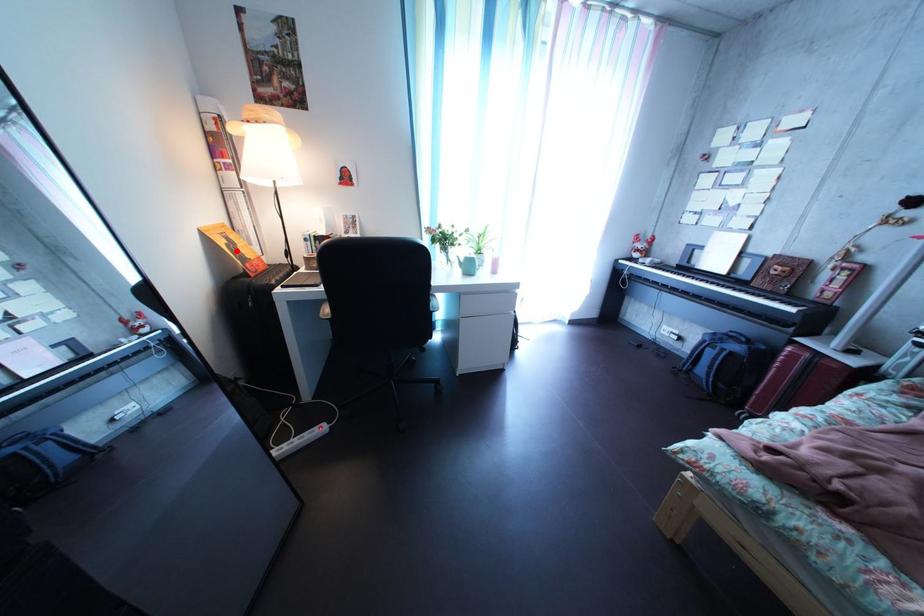
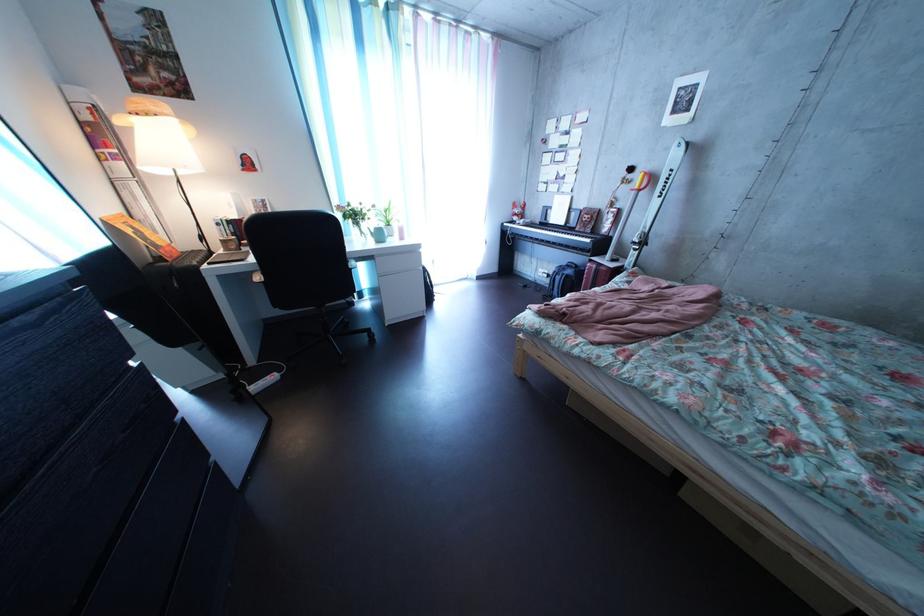
The point at the highlighted location is marked in the first image. Where is the corresponding point in the second image?

(142, 238)